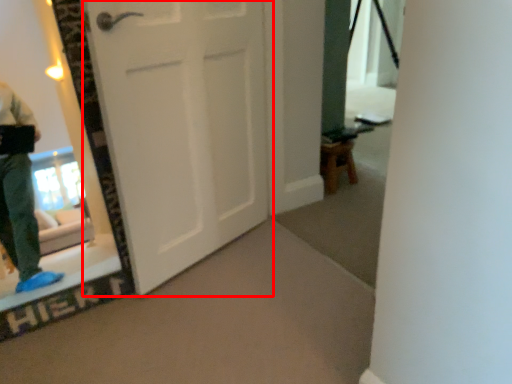
Question: Considering the relative positions of door (annotated by the red box) and furniture in the image provided, where is door (annotated by the red box) located with respect to the staircase?

Choices:
 (A) right
 (B) left

Answer: (B)